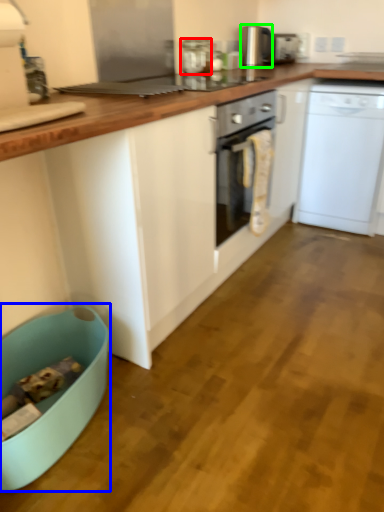
Question: Which is farther away from kitchen appliance (highlighted by a red box)? dish washer (highlighted by a blue box) or kitchen appliance (highlighted by a green box)?

Choices:
 (A) dish washer
 (B) kitchen appliance

Answer: (A)